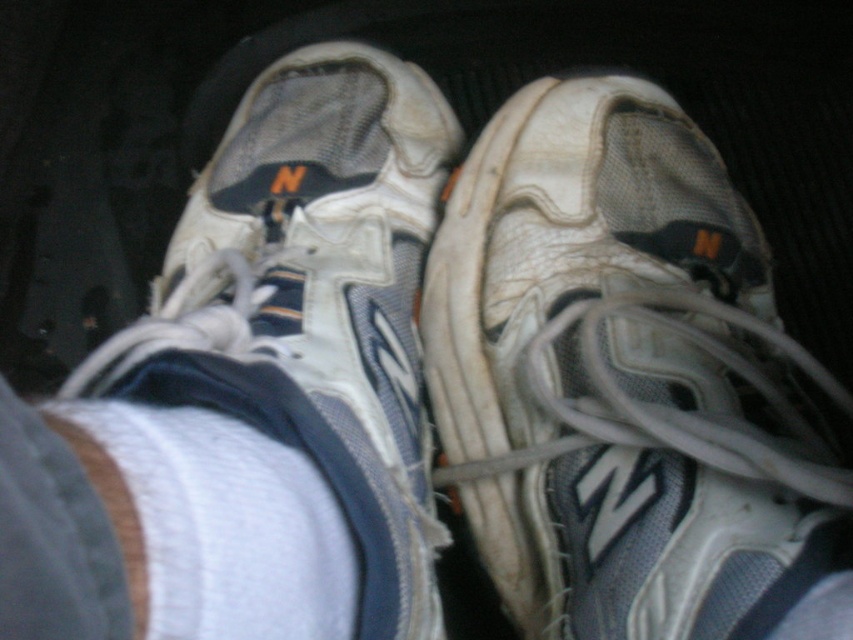
Question: Estimate the real-world distances between objects in this image. Which object is farther from the white mesh shoe at center?

Choices:
 (A) white mesh running shoe at center
 (B) white fabric at lower center
 (C) white fabric sock at lower center

Answer: (B)

Question: Does white mesh running shoe at center have a larger size compared to white fabric sock at lower center?

Choices:
 (A) yes
 (B) no

Answer: (A)

Question: Can you confirm if white mesh shoe at center is smaller than white fabric sock at lower center?

Choices:
 (A) yes
 (B) no

Answer: (B)

Question: Which of the following is the closest to the observer?

Choices:
 (A) white fabric at lower center
 (B) white mesh shoe at center
 (C) white fabric sock at lower center

Answer: (A)

Question: Among these objects, which one is farthest from the camera?

Choices:
 (A) white mesh running shoe at center
 (B) white fabric at lower center
 (C) white mesh shoe at center

Answer: (A)

Question: Is white mesh shoe at center to the left of white fabric at lower center from the viewer's perspective?

Choices:
 (A) yes
 (B) no

Answer: (B)